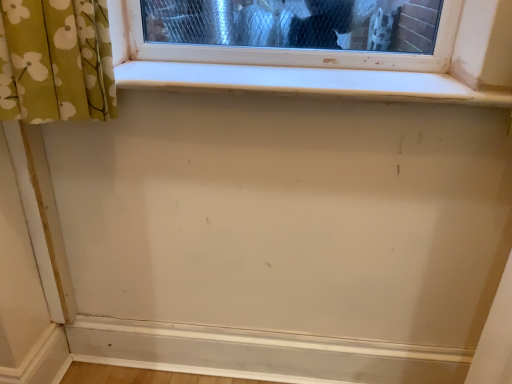
Image resolution: width=512 pixels, height=384 pixels. Find the location of `white smooth window sill at upper center`. white smooth window sill at upper center is located at coordinates (307, 82).

This screenshot has width=512, height=384. What do you see at coordinates (307, 82) in the screenshot?
I see `white smooth window sill at upper center` at bounding box center [307, 82].

Image resolution: width=512 pixels, height=384 pixels. In order to click on white smooth window sill at upper center in this screenshot , I will do pos(307,82).